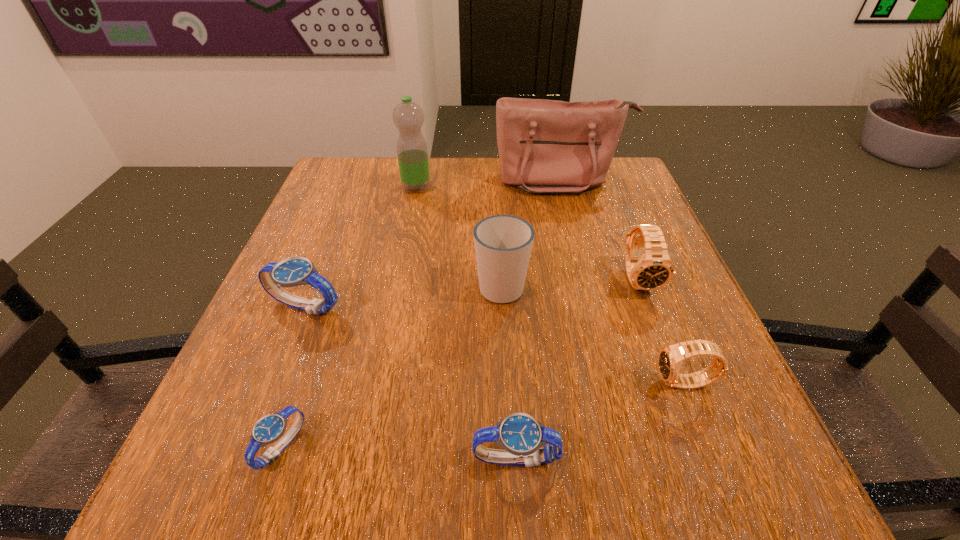
Identify which blue watch is the second nearest to the rightmost blue watch. Please provide its 2D coordinates. Your answer should be formatted as a tuple, i.e. [(x, y)], where the tuple contains the x and y coordinates of a point satisfying the conditions above.

[(294, 271)]